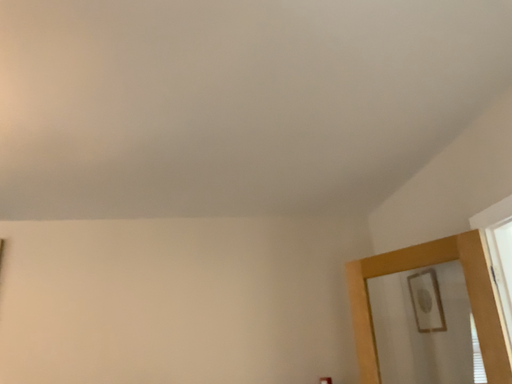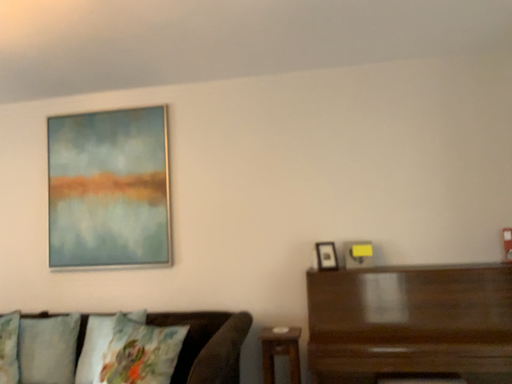
Question: How did the camera likely rotate when shooting the video?

Choices:
 (A) rotated upward
 (B) rotated downward

Answer: (B)